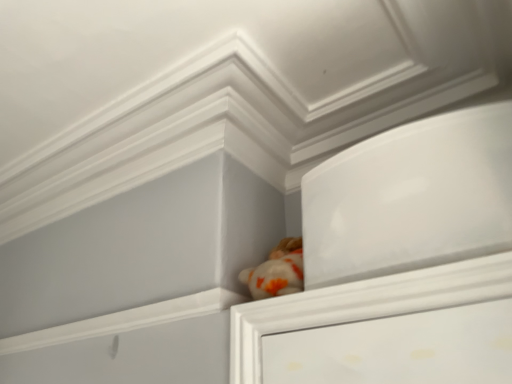
This screenshot has height=384, width=512. I want to click on white glossy drawer at lower left, so click(131, 356).

What do you see at coordinates (131, 356) in the screenshot? I see `white glossy drawer at lower left` at bounding box center [131, 356].

What are the coordinates of `white glossy drawer at lower left` in the screenshot? It's located at (131, 356).